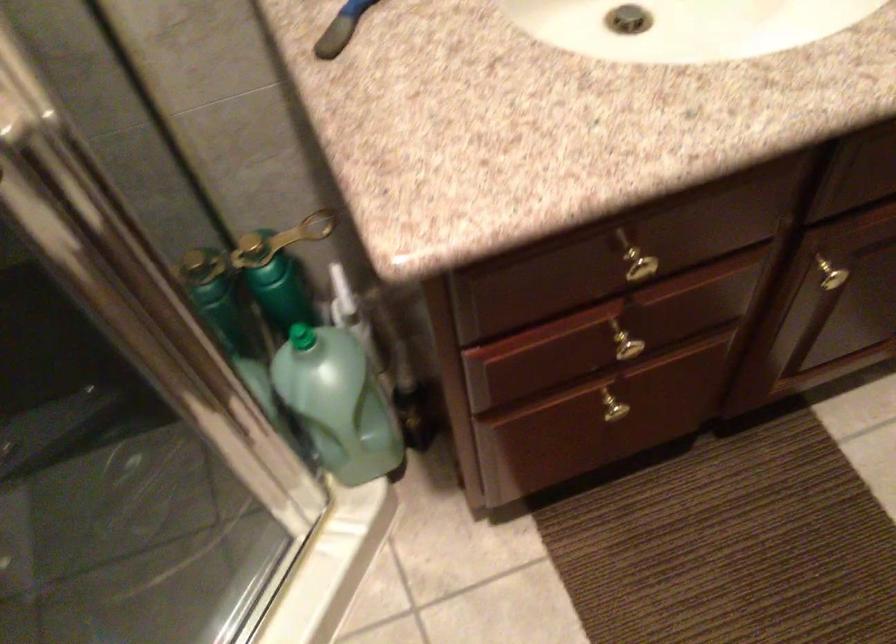
What do you see at coordinates (300, 337) in the screenshot? I see `the green bottle cap` at bounding box center [300, 337].